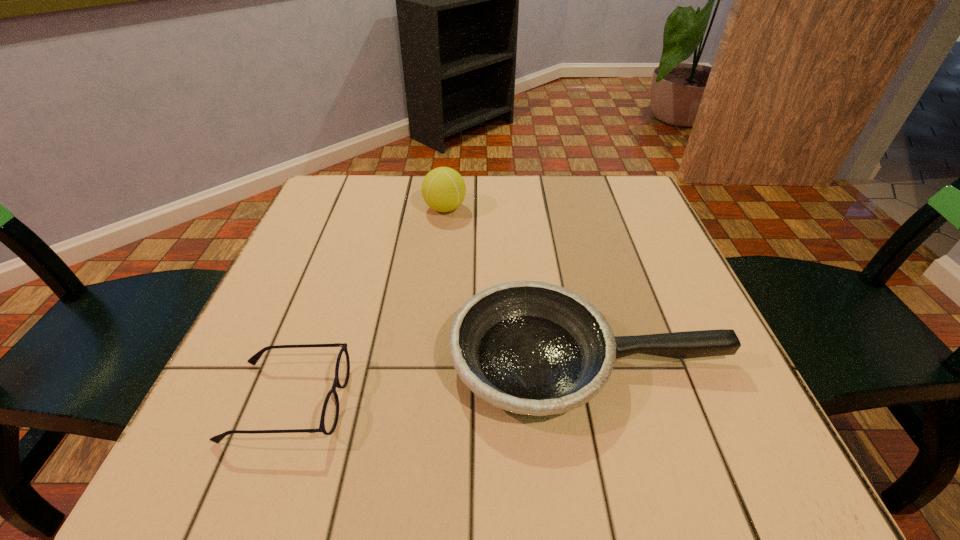
In order to click on free space between the leftmost object and the tallest object in this screenshot , I will do `click(367, 305)`.

Where is `vacant space in between the leftmost object and the frying pan`? vacant space in between the leftmost object and the frying pan is located at coordinates (439, 381).

Locate an element on the screen. The height and width of the screenshot is (540, 960). empty space that is in between the leftmost object and the tennis ball is located at coordinates (367, 305).

The image size is (960, 540). In order to click on unoccupied position between the frying pan and the spectacles in this screenshot , I will do `click(439, 381)`.

This screenshot has height=540, width=960. I want to click on free point between the spectacles and the farthest object, so click(367, 305).

This screenshot has height=540, width=960. In order to click on vacant region between the frying pan and the spectacles in this screenshot , I will do `click(439, 381)`.

This screenshot has height=540, width=960. Identify the location of vacant space that's between the spectacles and the tennis ball. (367, 305).

Locate an element on the screen. Image resolution: width=960 pixels, height=540 pixels. object that is the nearest to the frying pan is located at coordinates (330, 412).

Identify which object is located as the second nearest to the spectacles. Please provide its 2D coordinates. Your answer should be formatted as a tuple, i.e. [(x, y)], where the tuple contains the x and y coordinates of a point satisfying the conditions above.

[(443, 189)]

You are a GUI agent. You are given a task and a screenshot of the screen. Output one action in this format:
    pyautogui.click(x=<x>, y=<y>)
    Task: Click on the vacant space that satisfies the following two spatial constraints: 1. on the front side of the tennis ball; 2. on the front-facing side of the spectacles
    The image size is (960, 540).
    Given the screenshot: What is the action you would take?
    pyautogui.click(x=424, y=401)